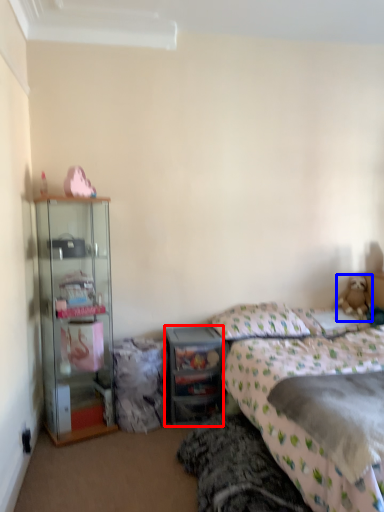
Question: Which object is further to the camera taking this photo, desk (highlighted by a red box) or teddy bear (highlighted by a blue box)?

Choices:
 (A) desk
 (B) teddy bear

Answer: (B)